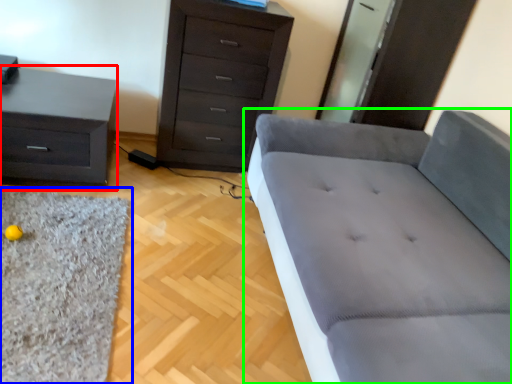
Question: Which is farther away from nightstand (highlighted by a red box)? mat (highlighted by a blue box) or studio couch (highlighted by a green box)?

Choices:
 (A) mat
 (B) studio couch

Answer: (B)